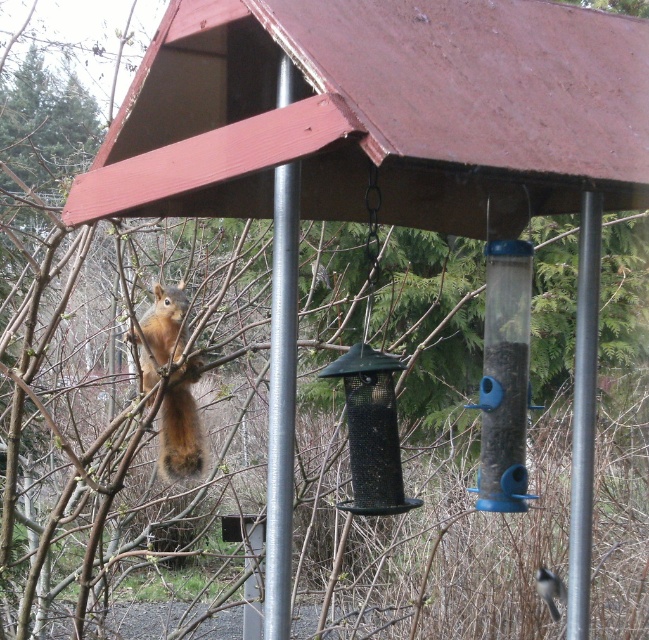
Consider the image. You are a birdwatcher trying to set up a new camera to capture the bird feeder station. You notice the brushed metal pole at center and the metallic gray pole at center. Which pole should you position your camera closer to if you want to capture both poles in the frame without moving the camera?

The brushed metal pole at center is positioned on the left side of metallic gray pole at center. To capture both poles in the frame without moving the camera, position the camera closer to the center where both poles are aligned.

You are a bird trying to reach the bird feeder station. You see the brushed metal pole at center and the shiny brown fur at left. Which object is higher from the ground?

The brushed metal pole at center is above the shiny brown fur at left, so the brushed metal pole at center is higher from the ground.